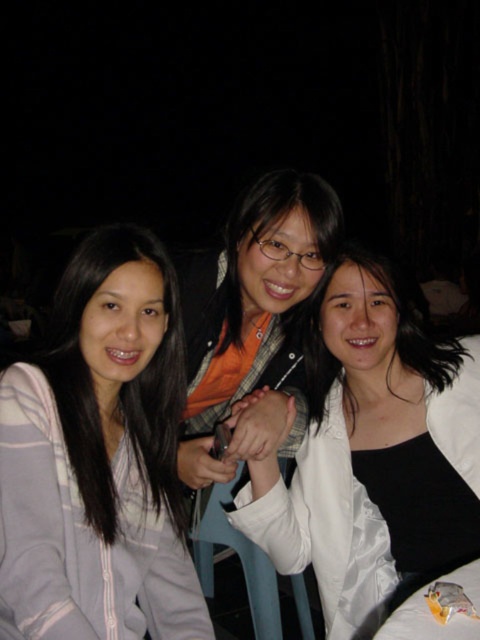
Question: Can you confirm if light gray cotton jacket at left is bigger than white satin blouse at center?

Choices:
 (A) yes
 (B) no

Answer: (B)

Question: Can you confirm if light gray cotton jacket at left is positioned to the left of white satin blouse at center?

Choices:
 (A) yes
 (B) no

Answer: (A)

Question: Which point appears closest to the camera in this image?

Choices:
 (A) (x=391, y=611)
 (B) (x=8, y=588)

Answer: (B)

Question: From the image, what is the correct spatial relationship of light gray cotton jacket at left in relation to white satin blouse at center?

Choices:
 (A) right
 (B) left

Answer: (B)

Question: Which of the following is the farthest from the observer?

Choices:
 (A) white satin blouse at center
 (B) light gray cotton jacket at left

Answer: (A)

Question: Among these points, which one is nearest to the camera?

Choices:
 (A) (454, 568)
 (B) (62, 307)

Answer: (B)